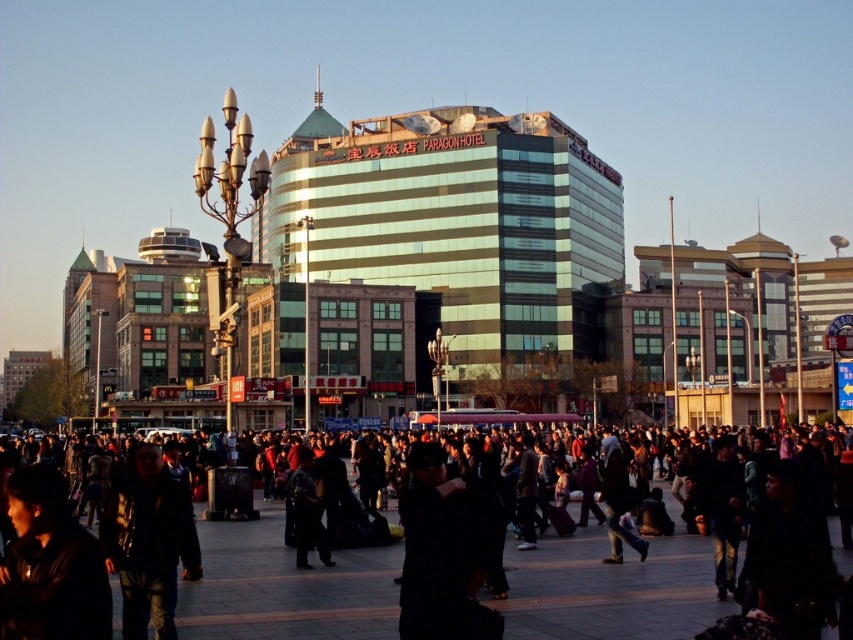
Question: Observing the image, what is the correct spatial positioning of dark matte jacket at lower left in reference to dark blue leather jacket at lower left?

Choices:
 (A) right
 (B) left

Answer: (B)

Question: Which point appears farthest from the camera in this image?

Choices:
 (A) (292, 525)
 (B) (381, 634)
 (C) (171, 554)

Answer: (A)

Question: In this image, where is black matte crowd at center located relative to dark matte jacket at lower left?

Choices:
 (A) right
 (B) left

Answer: (A)

Question: Among these objects, which one is nearest to the camera?

Choices:
 (A) dark blue leather jacket at lower left
 (B) dark matte jacket at lower left
 (C) dark gray fabric jacket at center

Answer: (B)

Question: Where is black matte crowd at center located in relation to dark blue leather jacket at lower left in the image?

Choices:
 (A) right
 (B) left

Answer: (A)

Question: Among these points, which one is farthest from the camera?

Choices:
 (A) (316, 531)
 (B) (149, 550)
 (C) (422, 589)

Answer: (A)